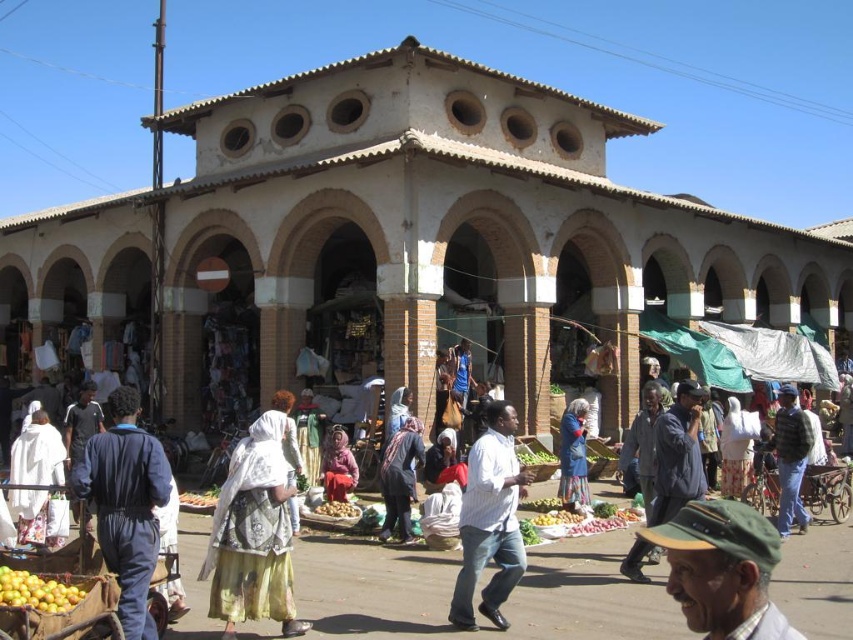
Question: Which of the following is the closest to the observer?

Choices:
 (A) printed fabric headscarf at center
 (B) blue fabric at center
 (C) yellow matte oranges at lower left
 (D) dark gray fabric headscarf at center

Answer: (C)

Question: Which object is closer to the camera taking this photo?

Choices:
 (A) dark gray fabric headscarf at center
 (B) printed fabric headscarf at center
 (C) dark blue tracksuit at lower left
 (D) blue fabric at center

Answer: (C)

Question: Does dark blue jeans at center come behind matte pink scarf at center?

Choices:
 (A) no
 (B) yes

Answer: (A)

Question: Which object appears closest to the camera in this image?

Choices:
 (A) white striped shirt at center
 (B) yellow matte oranges at lower left
 (C) matte pink scarf at center

Answer: (B)

Question: In this image, where is printed fabric headscarf at center located relative to blue fabric at center?

Choices:
 (A) below
 (B) above

Answer: (A)

Question: Does white striped shirt at center appear on the left side of yellow matte oranges at lower left?

Choices:
 (A) no
 (B) yes

Answer: (A)